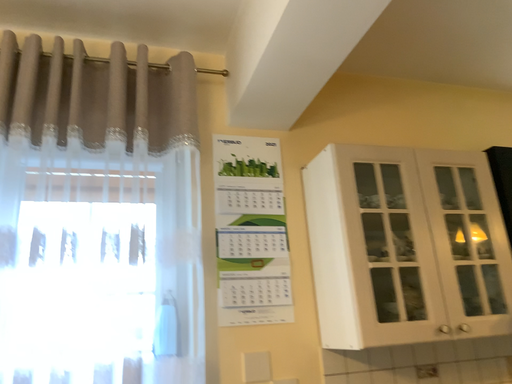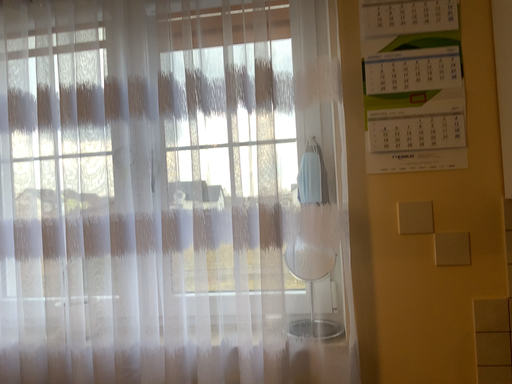
Question: Which way did the camera rotate in the video?

Choices:
 (A) rotated left
 (B) rotated right

Answer: (A)